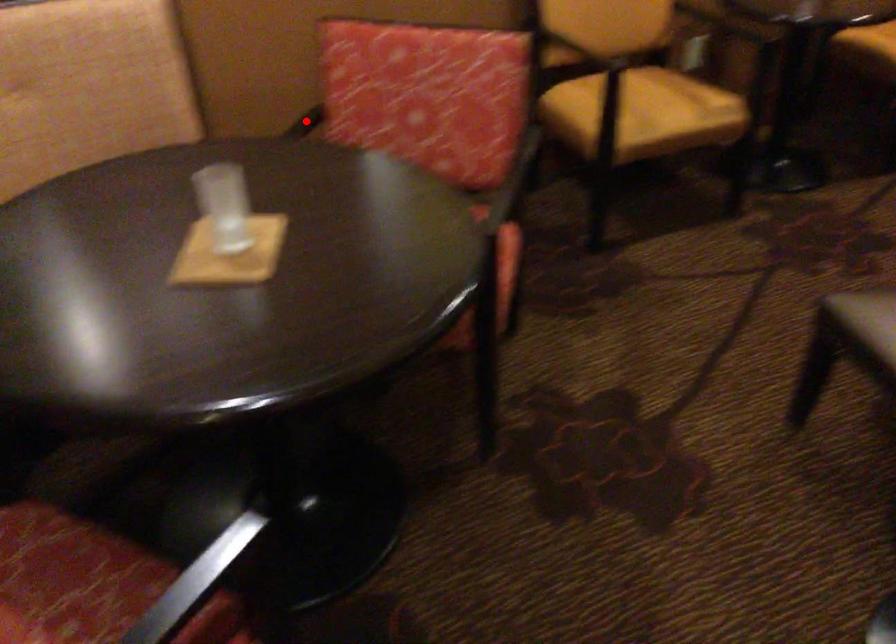
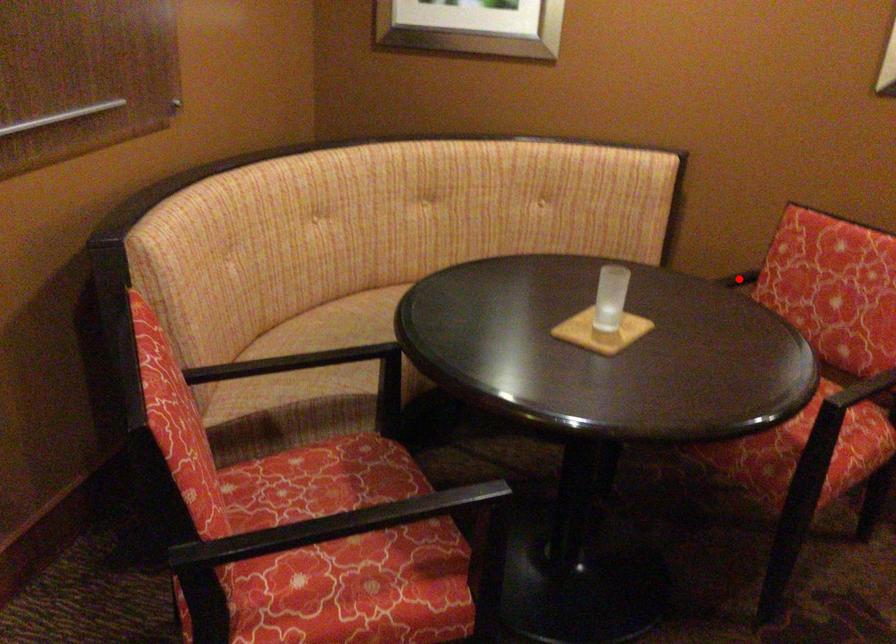
I am providing you with two images of the same scene from different viewpoints. A red point is marked on the first image and another point is marked on the second image. Is the red point in image1 aligned with the point shown in image2?

Yes